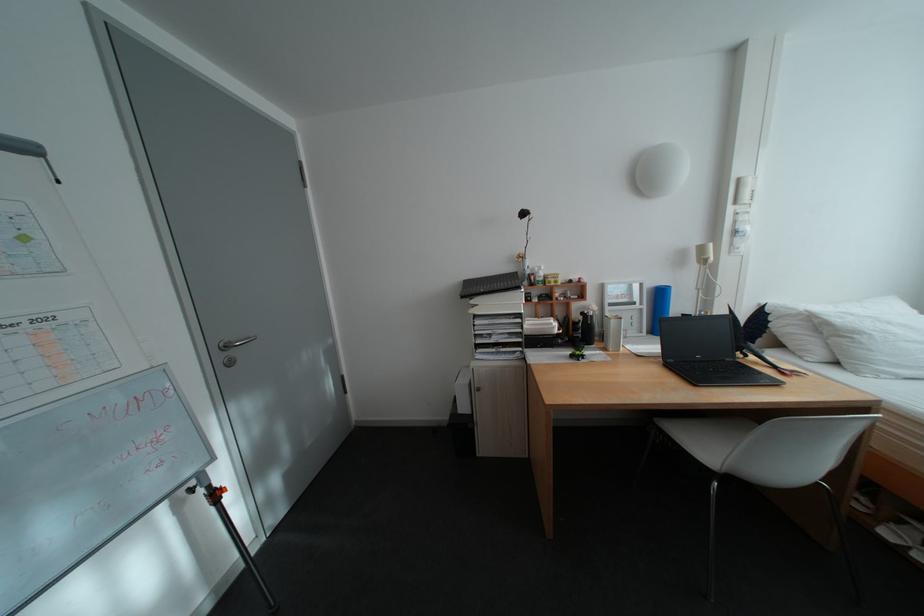
Find the location of a particular element. This screenshot has width=924, height=616. door lock is located at coordinates (227, 342).